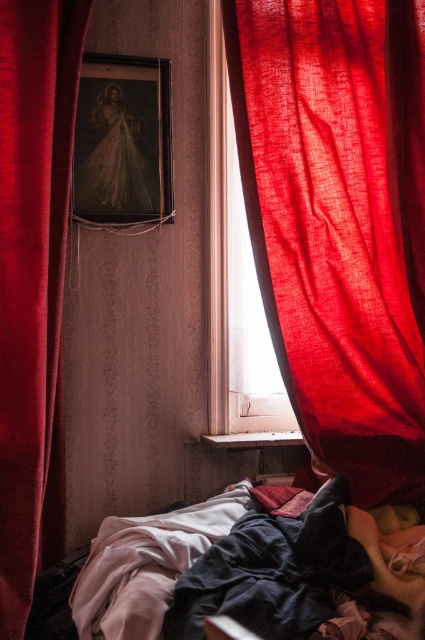
Is point (223, 420) behind point (73, 188)?

That is True.

Looking at this image, can you confirm if translucent fabric window at center is smaller than wooden framed portrait at center?

Actually, translucent fabric window at center might be larger than wooden framed portrait at center.

Where is `translucent fabric window at center`? Image resolution: width=425 pixels, height=640 pixels. translucent fabric window at center is located at coordinates (235, 278).

Is matte red curtain at center taller than dark blue fabric bed at lower center?

Yes.

Is matte red curtain at center below dark blue fabric bed at lower center?

Actually, matte red curtain at center is above dark blue fabric bed at lower center.

Who is more forward, (413,323) or (319,605)?

Positioned in front is point (319,605).

The height and width of the screenshot is (640, 425). I want to click on matte red curtain at center, so click(x=339, y=221).

Who is shorter, matte red curtain at center or velvet-like red curtain at left?

matte red curtain at center is shorter.

Is matte red curtain at center shorter than velvet-like red curtain at left?

Correct, matte red curtain at center is not as tall as velvet-like red curtain at left.

Where is `matte red curtain at center`? matte red curtain at center is located at coordinates click(x=339, y=221).

You are a GUI agent. You are given a task and a screenshot of the screen. Output one action in this format:
    pyautogui.click(x=<x>, y=<y>)
    Task: Click on the matte red curtain at center
    The width and height of the screenshot is (425, 640).
    Given the screenshot: What is the action you would take?
    pyautogui.click(x=339, y=221)